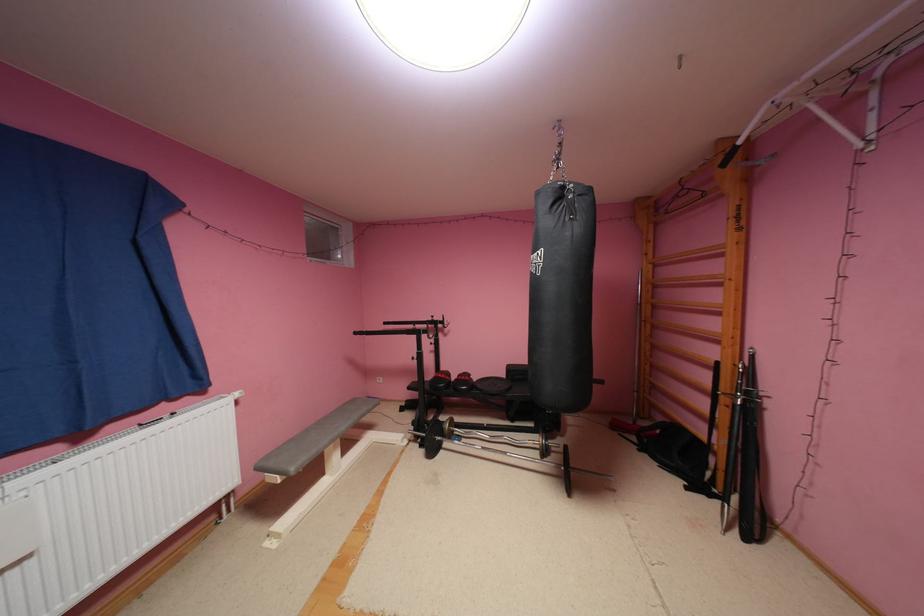
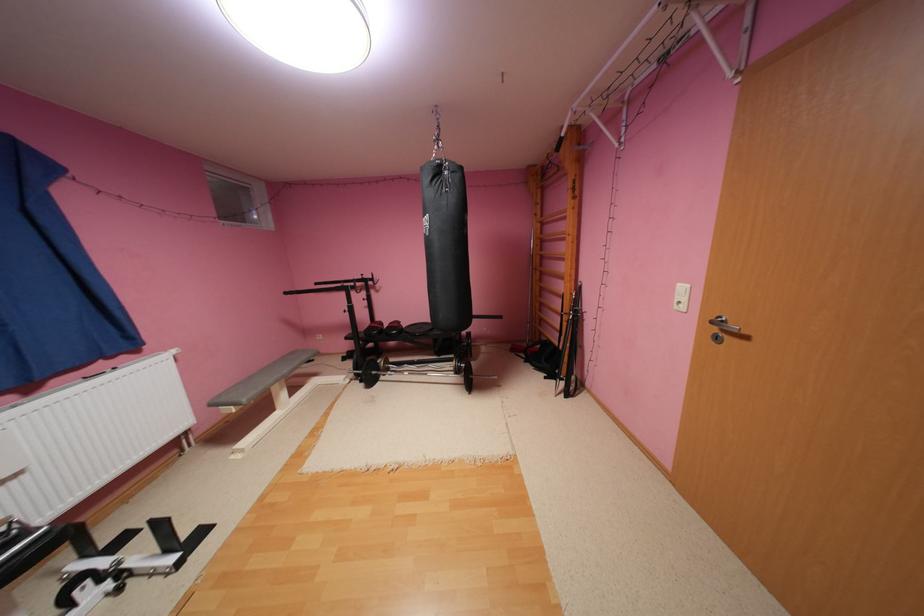
Find the pixel in the second image that matches [626,427] in the first image.

(524, 350)